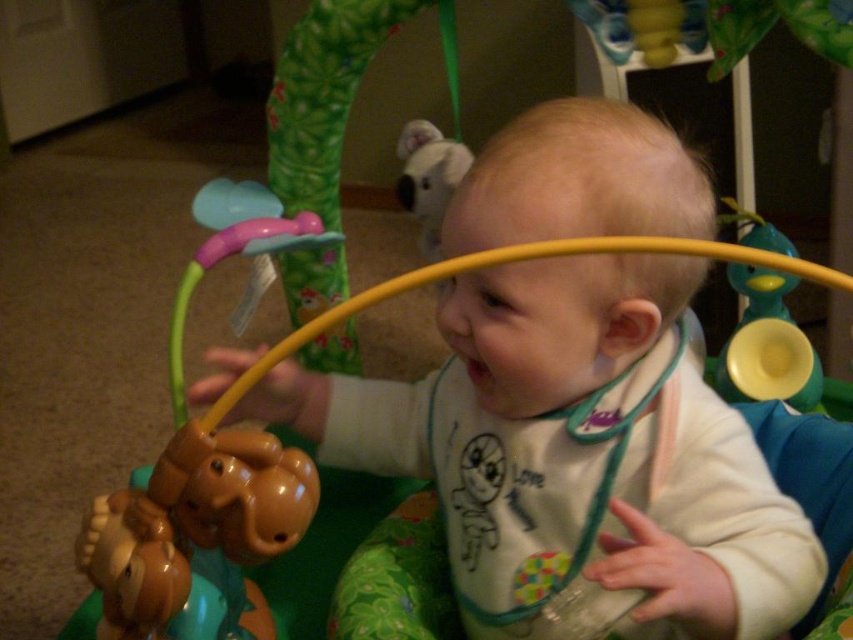
You are a photographer taking a picture of the baby in the activity center. You need to ensure both the white matte bib at center and the fluffy white plush at upper center are clearly visible in the frame. Which object should you adjust your focus on first to ensure both are in focus, considering their sizes?

The white matte bib at center is wider than the fluffy white plush at upper center, so focusing on the larger white matte bib at center first will help ensure both objects are in focus.

You are a photographer standing in front of the baby in the activity center. You want to take a closeup shot of the baby but need to ensure the white matte bib at center is not in the way. Can you position yourself so that the bib is out of the frame?

The white matte bib at center is located at point (x=572, y=451) in 2D space. Since the photographer can adjust their angle or position, they can move slightly to the side or tilt the camera to avoid framing the bib, ensuring the baby remains the focus while excluding the bib from the shot.